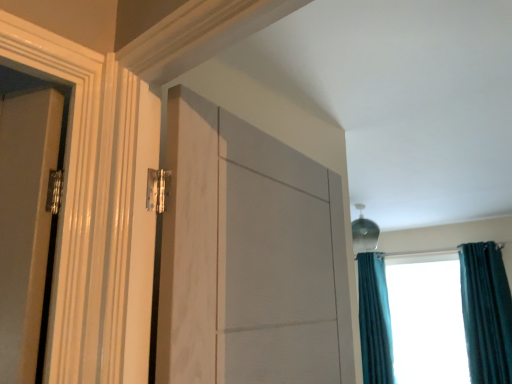
In order to face teal curtain at right, should I rotate leftwards or rightwards?

To face it directly, rotate right by 21.575 degrees.

How much space does teal velvet curtain at right, which appears as the second curtain when viewed from the back, occupy vertically?

4.29 feet.

Where is `white marble door at center`? This screenshot has height=384, width=512. white marble door at center is located at coordinates (249, 257).

Does teal curtain at right have a greater height compared to teal velvet curtain at right, the first curtain viewed from the right?

Indeed, teal curtain at right has a greater height compared to teal velvet curtain at right, the first curtain viewed from the right.

What's the angular difference between teal curtain at right and teal velvet curtain at right, which is the first curtain in front-to-back order,'s facing directions?

The angular difference between teal curtain at right and teal velvet curtain at right, which is the first curtain in front-to-back order, is 0.793 degrees.

Considering the relative positions of teal curtain at right and teal velvet curtain at right, marked as the second curtain in a left-to-right arrangement, in the image provided, is teal curtain at right to the right of teal velvet curtain at right, marked as the second curtain in a left-to-right arrangement, from the viewer's perspective?

Incorrect, teal curtain at right is not on the right side of teal velvet curtain at right, marked as the second curtain in a left-to-right arrangement.

Considering the sizes of teal curtain at right and teal velvet curtain at right, marked as the second curtain in a left-to-right arrangement, in the image, is teal curtain at right bigger or smaller than teal velvet curtain at right, marked as the second curtain in a left-to-right arrangement,?

Clearly, teal curtain at right is larger in size than teal velvet curtain at right, marked as the second curtain in a left-to-right arrangement.

Is there a large distance between teal velvet curtain at right, which appears as the second curtain when viewed from the back, and white marble door at center?

Yes, teal velvet curtain at right, which appears as the second curtain when viewed from the back, and white marble door at center are quite far apart.

Is white marble door at center a part of teal velvet curtain at right, which appears as the second curtain when viewed from the back?

No, white marble door at center is not a part of teal velvet curtain at right, which appears as the second curtain when viewed from the back.

How distant is teal velvet curtain at right, which is the first curtain in front-to-back order, from white marble door at center?

teal velvet curtain at right, which is the first curtain in front-to-back order, and white marble door at center are 11.11 feet apart from each other.

Can you confirm if teal velvet curtain at right, the first curtain viewed from the right, is positioned to the right of white marble door at center?

Yes, teal velvet curtain at right, the first curtain viewed from the right, is to the right of white marble door at center.

Is teal velvet curtain at right, which appears as the second curtain when viewed from the back, a part of white marble door at center?

No, white marble door at center does not contain teal velvet curtain at right, which appears as the second curtain when viewed from the back.

Considering the positions of objects white marble door at center and teal velvet curtain at right, which is the first curtain in front-to-back order, in the image provided, who is more to the left, white marble door at center or teal velvet curtain at right, which is the first curtain in front-to-back order,?

From the viewer's perspective, white marble door at center appears more on the left side.

In terms of height, does white marble door at center look taller or shorter compared to teal velvet curtain at right, which is the first curtain in front-to-back order?

white marble door at center is shorter than teal velvet curtain at right, which is the first curtain in front-to-back order.

How different are the orientations of white marble door at center and teal velvet curtain at right, which is the first curtain in front-to-back order, in degrees?

They differ by 97.6 degrees in their facing directions.

Does point (364, 275) lie in front of point (466, 302)?

That is False.

Considering the sizes of objects teal velvet curtain at right, which is the second curtain from front to back, and teal curtain at right in the image provided, who is taller, teal velvet curtain at right, which is the second curtain from front to back, or teal curtain at right?

teal curtain at right is taller.

Can you tell me how much teal velvet curtain at right, which is the second curtain from front to back, and teal curtain at right differ in facing direction?

There is a 2.64-degree angle between the facing directions of teal velvet curtain at right, which is the second curtain from front to back, and teal curtain at right.

Who is bigger, teal velvet curtain at right, which is the first curtain in back-to-front order, or teal curtain at right?

Bigger between the two is teal curtain at right.

Can you confirm if teal curtain at right is positioned to the left of teal velvet curtain at right, which is the second curtain from front to back?

No, teal curtain at right is not to the left of teal velvet curtain at right, which is the second curtain from front to back.

Based on their sizes in the image, would you say teal curtain at right is bigger or smaller than teal velvet curtain at right, marked as the second curtain in a right-to-left arrangement?

Considering their sizes, teal curtain at right takes up more space than teal velvet curtain at right, marked as the second curtain in a right-to-left arrangement.

From a real-world perspective, which object stands above the other?

In real-world perspective, teal velvet curtain at right, which is the second curtain from front to back, is above.

From the image's perspective, does teal curtain at right appear lower than teal velvet curtain at right, marked as the second curtain in a right-to-left arrangement?

No.

This screenshot has height=384, width=512. I want to click on door lying above the teal curtain at right (from the image's perspective), so click(x=249, y=257).

Considering the sizes of objects white marble door at center and teal curtain at right in the image provided, who is wider, white marble door at center or teal curtain at right?

teal curtain at right is wider.

From a real-world perspective, who is located lower, white marble door at center or teal curtain at right?

teal curtain at right, from a real-world perspective.

Is white marble door at center inside or outside of teal curtain at right?

white marble door at center is spatially situated outside teal curtain at right.

Can you confirm if teal velvet curtain at right, the 1th curtain when ordered from left to right, is thinner than teal velvet curtain at right, which is the first curtain in front-to-back order?

Yes, teal velvet curtain at right, the 1th curtain when ordered from left to right, is thinner than teal velvet curtain at right, which is the first curtain in front-to-back order.

Is point (375, 303) in front of point (471, 380)?

That is False.

Considering the relative positions of teal velvet curtain at right, which is the second curtain from front to back, and teal velvet curtain at right, which appears as the second curtain when viewed from the back, in the image provided, is teal velvet curtain at right, which is the second curtain from front to back, to the left of teal velvet curtain at right, which appears as the second curtain when viewed from the back, from the viewer's perspective?

Yes, teal velvet curtain at right, which is the second curtain from front to back, is to the left of teal velvet curtain at right, which appears as the second curtain when viewed from the back.

Is teal velvet curtain at right, marked as the second curtain in a right-to-left arrangement, looking in the opposite direction of teal velvet curtain at right, marked as the second curtain in a left-to-right arrangement?

No, teal velvet curtain at right, marked as the second curtain in a right-to-left arrangement, is not facing the opposite direction of teal velvet curtain at right, marked as the second curtain in a left-to-right arrangement.

The width and height of the screenshot is (512, 384). I want to click on window below the teal velvet curtain at right, the first curtain viewed from the right (from the image's perspective), so click(486, 313).

This screenshot has width=512, height=384. Find the location of `the 1st curtain behind the white marble door at center, counting from the anchor's position`. the 1st curtain behind the white marble door at center, counting from the anchor's position is located at coordinates (486, 313).

From the image, which object appears to be farther from teal velvet curtain at right, the 1th curtain when ordered from left to right, white marble door at center or teal velvet curtain at right, the first curtain viewed from the right?

white marble door at center is positioned further to the anchor teal velvet curtain at right, the 1th curtain when ordered from left to right.

Based on their spatial positions, is teal velvet curtain at right, the first curtain viewed from the right, or white marble door at center closer to teal curtain at right?

Based on the image, teal velvet curtain at right, the first curtain viewed from the right, appears to be nearer to teal curtain at right.

Looking at the image, which one is located closer to teal velvet curtain at right, the 1th curtain when ordered from left to right, white marble door at center or teal curtain at right?

teal curtain at right is closer to teal velvet curtain at right, the 1th curtain when ordered from left to right.

Based on the photo, based on their spatial positions, is teal curtain at right or white marble door at center further from teal velvet curtain at right, marked as the second curtain in a left-to-right arrangement?

white marble door at center is positioned further to the anchor teal velvet curtain at right, marked as the second curtain in a left-to-right arrangement.

From the image, which object appears to be nearer to teal curtain at right, teal velvet curtain at right, which is the second curtain from front to back, or white marble door at center?

The object closer to teal curtain at right is teal velvet curtain at right, which is the second curtain from front to back.

Looking at the image, which one is located closer to teal velvet curtain at right, the first curtain viewed from the right, teal curtain at right or teal velvet curtain at right, the 1th curtain when ordered from left to right?

teal curtain at right.

Which object lies nearer to the anchor point teal velvet curtain at right, which appears as the second curtain when viewed from the back, white marble door at center or teal velvet curtain at right, which is the second curtain from front to back?

teal velvet curtain at right, which is the second curtain from front to back.

When comparing their distances from teal curtain at right, does teal velvet curtain at right, which is the first curtain in back-to-front order, or teal velvet curtain at right, marked as the second curtain in a left-to-right arrangement, seem closer?

teal velvet curtain at right, marked as the second curtain in a left-to-right arrangement, is positioned closer to the anchor teal curtain at right.

Where is `curtain between white marble door at center and teal curtain at right in the front-back direction`? curtain between white marble door at center and teal curtain at right in the front-back direction is located at coordinates (486, 313).

At what (x,y) coordinates should I click in order to perform the action: click on window between white marble door at center and teal velvet curtain at right, which is the second curtain from front to back, in the front-back direction. Please return your answer as a coordinate pair (x, y). The image size is (512, 384). Looking at the image, I should click on (486, 313).

Locate an element on the screen. The width and height of the screenshot is (512, 384). window located between teal velvet curtain at right, which is the second curtain from front to back, and teal velvet curtain at right, which is the first curtain in front-to-back order, in the left-right direction is located at coordinates tap(486, 313).

Where is `curtain between white marble door at center and teal velvet curtain at right, which is the second curtain from front to back, along the z-axis`? The width and height of the screenshot is (512, 384). curtain between white marble door at center and teal velvet curtain at right, which is the second curtain from front to back, along the z-axis is located at coordinates (486, 313).